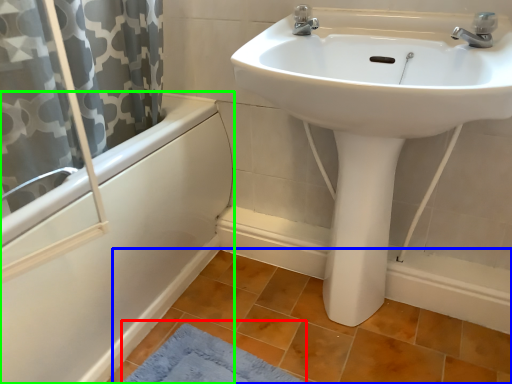
Question: Which is farther away from bath mat (highlighted by a red box)? tile (highlighted by a blue box) or bathtub (highlighted by a green box)?

Choices:
 (A) tile
 (B) bathtub

Answer: (B)